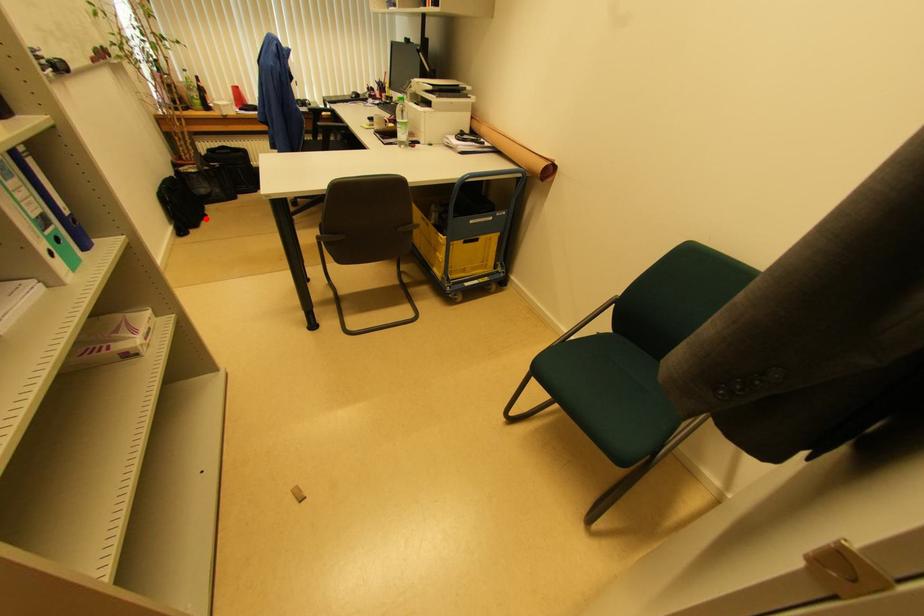
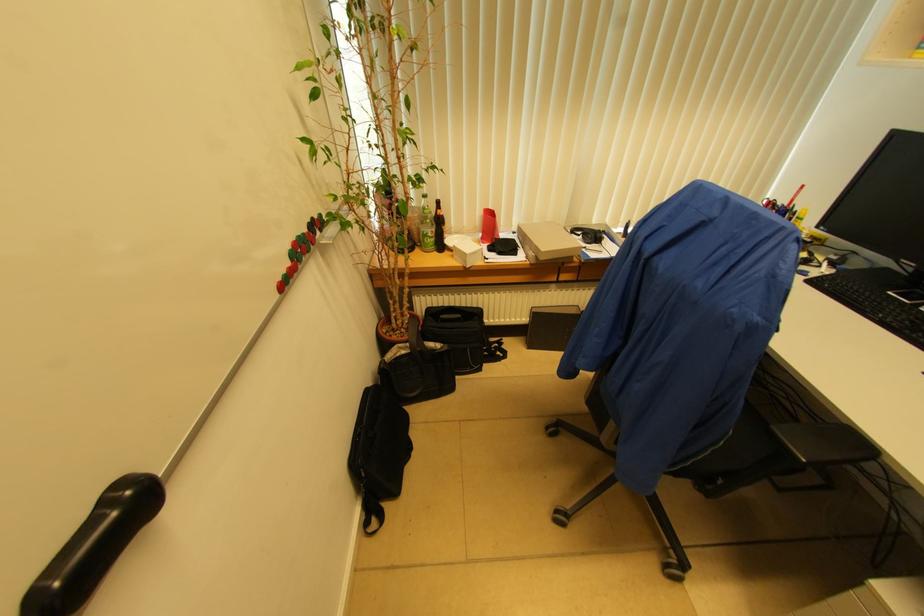
Where in the second image is the point corresponding to the highlighted location from the first image?

(409, 451)